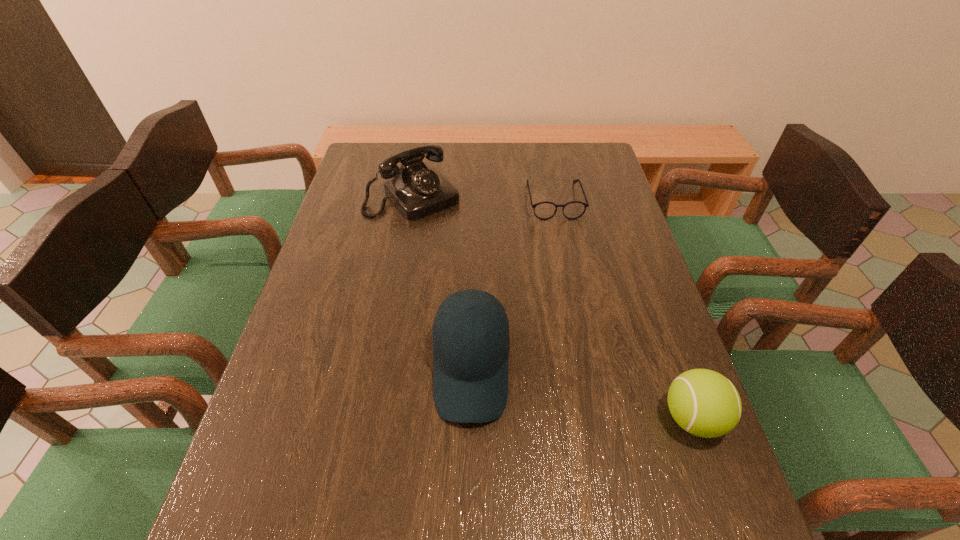
Identify the location of baseball cap. (470, 385).

You are a GUI agent. You are given a task and a screenshot of the screen. Output one action in this format:
    pyautogui.click(x=<x>, y=<y>)
    Task: Click on the rightmost object
    The height and width of the screenshot is (540, 960).
    Given the screenshot: What is the action you would take?
    pyautogui.click(x=705, y=403)

You are a GUI agent. You are given a task and a screenshot of the screen. Output one action in this format:
    pyautogui.click(x=<x>, y=<y>)
    Task: Click on the third tallest object
    
    Given the screenshot: What is the action you would take?
    pyautogui.click(x=705, y=403)

Find the location of `the shortest object`. the shortest object is located at coordinates (545, 210).

Identify the location of spectacles. The image size is (960, 540). (545, 210).

The height and width of the screenshot is (540, 960). I want to click on telephone, so click(x=417, y=190).

You are a GUI agent. You are given a task and a screenshot of the screen. Output one action in this format:
    pyautogui.click(x=<x>, y=<y>)
    Task: Click on the vacant space located on the front-facing side of the baseball cap
    
    Given the screenshot: What is the action you would take?
    pyautogui.click(x=469, y=464)

Locate an element on the screen. Image resolution: width=960 pixels, height=540 pixels. free space located 0.060m on the front of the tennis ball is located at coordinates (715, 482).

Locate an element on the screen. free space located on the front-facing side of the shortest object is located at coordinates (563, 235).

At what (x,y) coordinates should I click in order to perform the action: click on free space located 0.340m on the front-facing side of the shortest object. Please return your answer as a coordinate pair (x, y). This screenshot has width=960, height=540. Looking at the image, I should click on (579, 306).